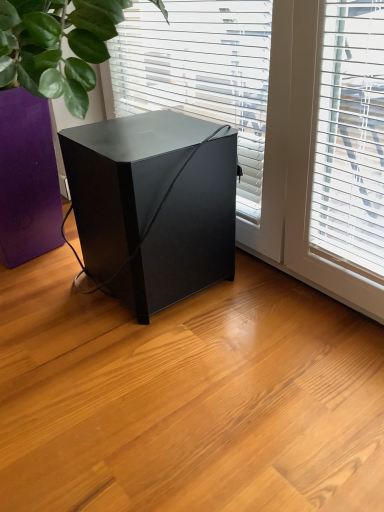
Locate an element on the screen. The width and height of the screenshot is (384, 512). vacant area to the left of matte black speaker at center is located at coordinates (46, 290).